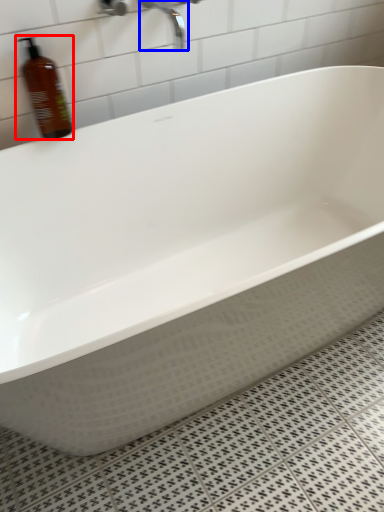
Question: Among these objects, which one is nearest to the camera, bottle (highlighted by a red box) or faucet (highlighted by a blue box)?

Choices:
 (A) bottle
 (B) faucet

Answer: (A)